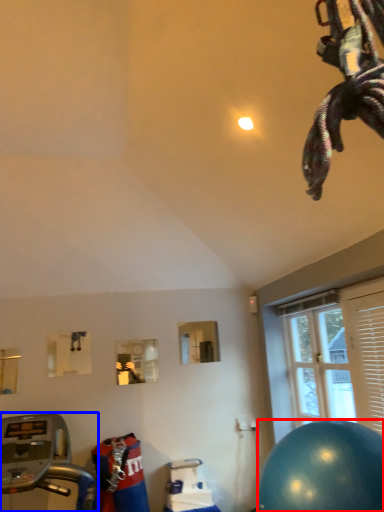
Question: Which object appears closest to the camera in this image, ball (highlighted by a red box) or treadmill (highlighted by a blue box)?

Choices:
 (A) ball
 (B) treadmill

Answer: (B)